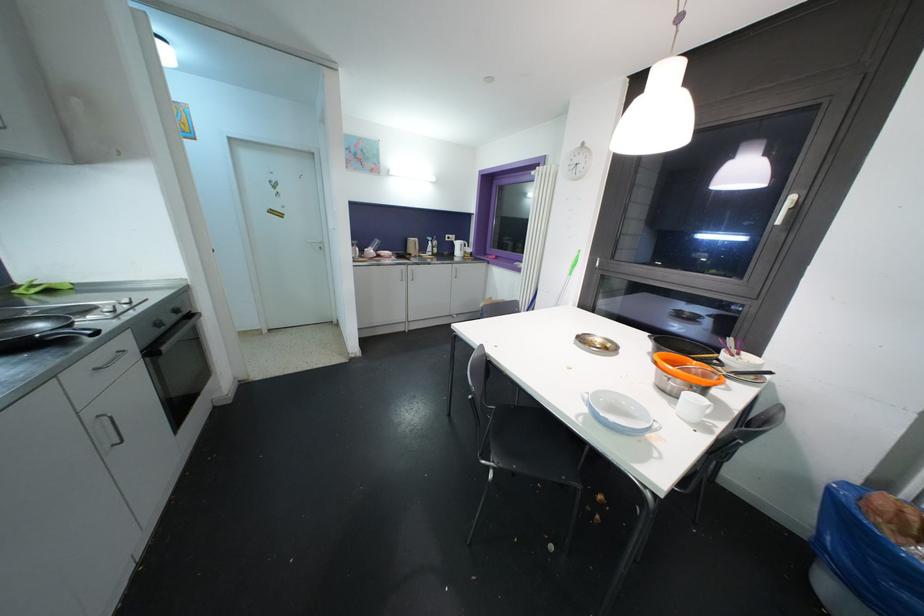
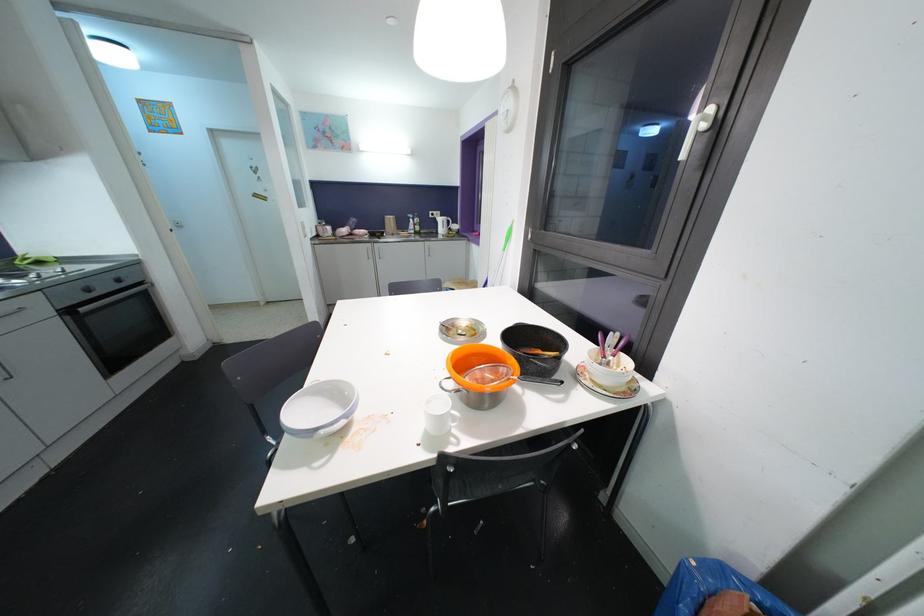
The point at (166, 351) is marked in the first image. Where is the corresponding point in the second image?

(84, 312)